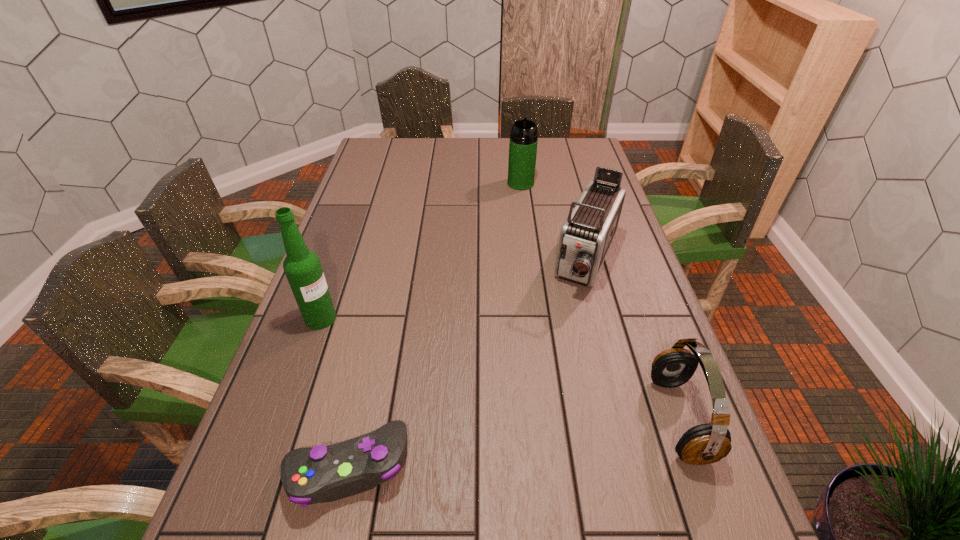
The height and width of the screenshot is (540, 960). Identify the location of vacant space situated 0.220m from the spout of the third object from left to right. (523, 228).

Find the location of a particular element. free space located 0.050m on the label of the beer bottle is located at coordinates (346, 333).

At what (x,y) coordinates should I click in order to perform the action: click on vacant space located 0.360m on the label of the beer bottle. Please return your answer as a coordinate pair (x, y). This screenshot has height=540, width=960. Looking at the image, I should click on (446, 394).

Locate an element on the screen. free space located 0.200m on the label of the beer bottle is located at coordinates (392, 361).

You are a GUI agent. You are given a task and a screenshot of the screen. Output one action in this format:
    pyautogui.click(x=<x>, y=<y>)
    Task: Click on the free space located 0.390m at the lens of the camcorder
    The width and height of the screenshot is (960, 540).
    Given the screenshot: What is the action you would take?
    pyautogui.click(x=525, y=417)

You are a GUI agent. You are given a task and a screenshot of the screen. Output one action in this format:
    pyautogui.click(x=<x>, y=<y>)
    Task: Click on the free space located 0.140m at the lens of the camcorder
    Image resolution: width=960 pixels, height=540 pixels.
    Given the screenshot: What is the action you would take?
    (x=563, y=334)

The image size is (960, 540). I want to click on vacant space located 0.080m at the lens of the camcorder, so click(x=570, y=318).

You are a GUI agent. You are given a task and a screenshot of the screen. Output one action in this format:
    pyautogui.click(x=<x>, y=<y>)
    Task: Click on the control located in the near edge section of the desktop
    Image resolution: width=960 pixels, height=540 pixels.
    Given the screenshot: What is the action you would take?
    pyautogui.click(x=321, y=474)

Locate an element on the screen. The image size is (960, 540). headset that is at the near edge is located at coordinates (708, 443).

Locate an element on the screen. control at the left edge is located at coordinates (321, 474).